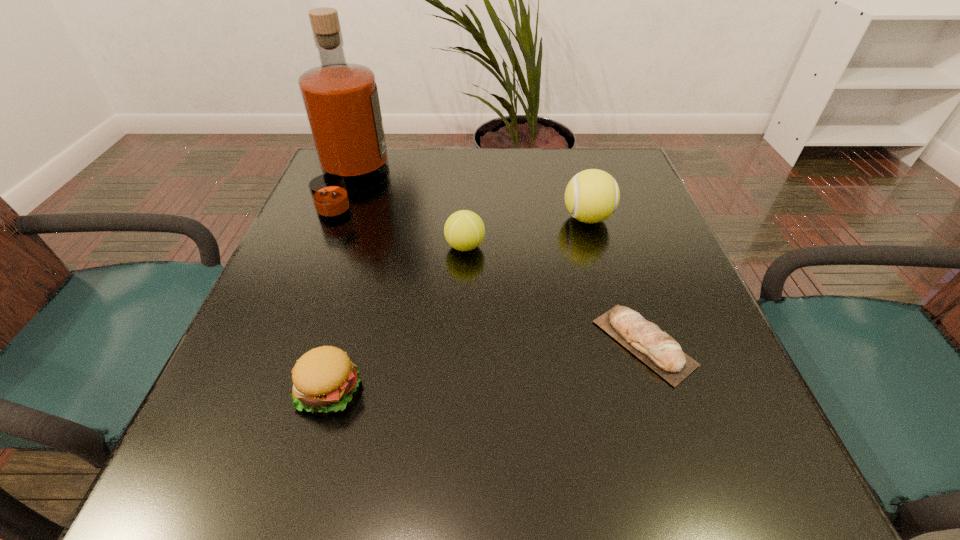
This screenshot has width=960, height=540. Find the location of `the tallest object`. the tallest object is located at coordinates (341, 101).

What are the coordinates of `the taller tennis ball` in the screenshot? It's located at (591, 196).

In order to click on the right tennis ball in this screenshot , I will do `click(591, 196)`.

Where is `the third object from left to right`? the third object from left to right is located at coordinates (464, 230).

Find the location of a particular element. This screenshot has height=540, width=960. the left tennis ball is located at coordinates (464, 230).

Where is `the second shortest object`? This screenshot has height=540, width=960. the second shortest object is located at coordinates (324, 378).

Identify the location of pita bread. (663, 354).

The height and width of the screenshot is (540, 960). I want to click on free space located 0.110m on the front label of the liquor, so click(431, 187).

The width and height of the screenshot is (960, 540). What are the coordinates of `free space located 0.080m on the front of the right tennis ball` in the screenshot? It's located at (599, 259).

Identify the location of vacant area located on the back of the third object from left to right. The height and width of the screenshot is (540, 960). (467, 212).